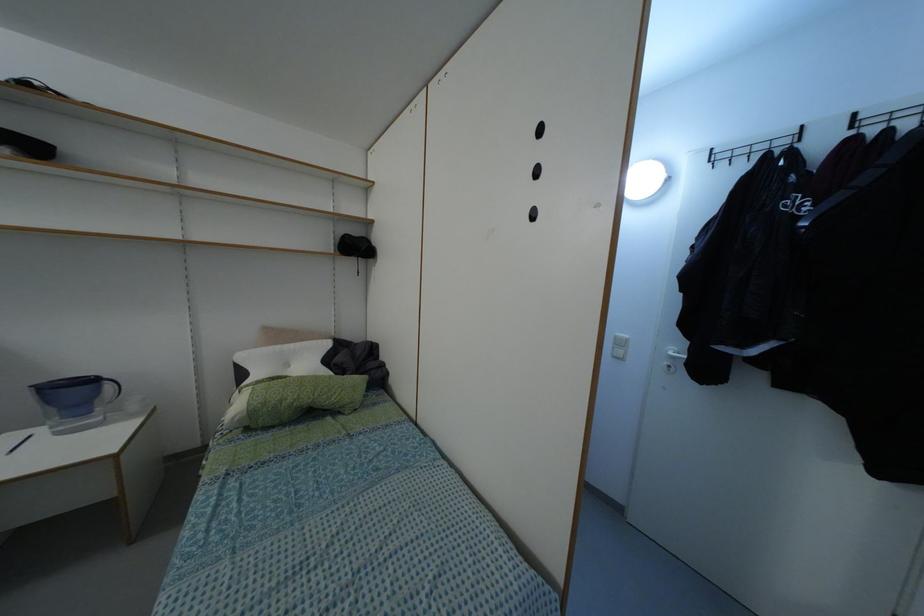
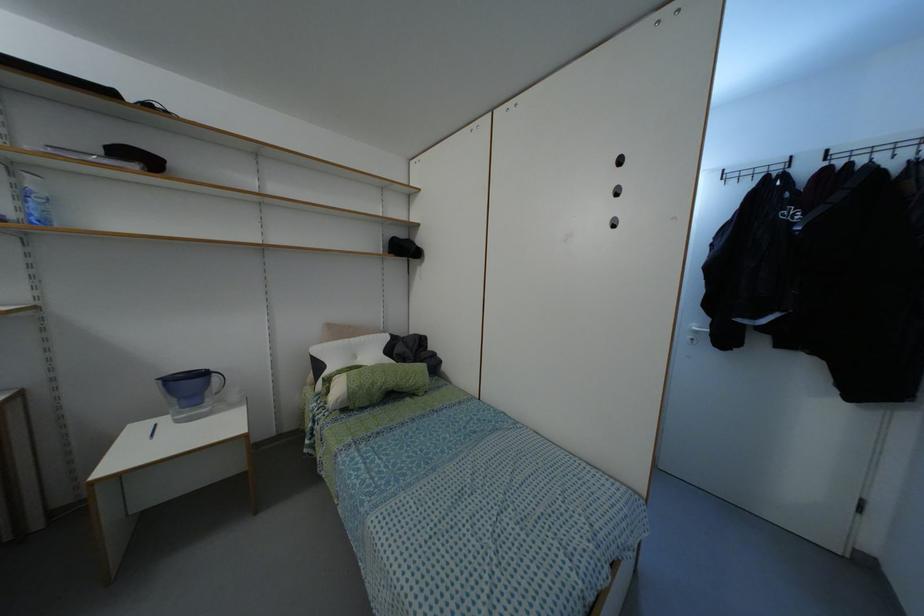
The point at [281,400] is marked in the first image. Where is the corresponding point in the second image?

(371, 384)